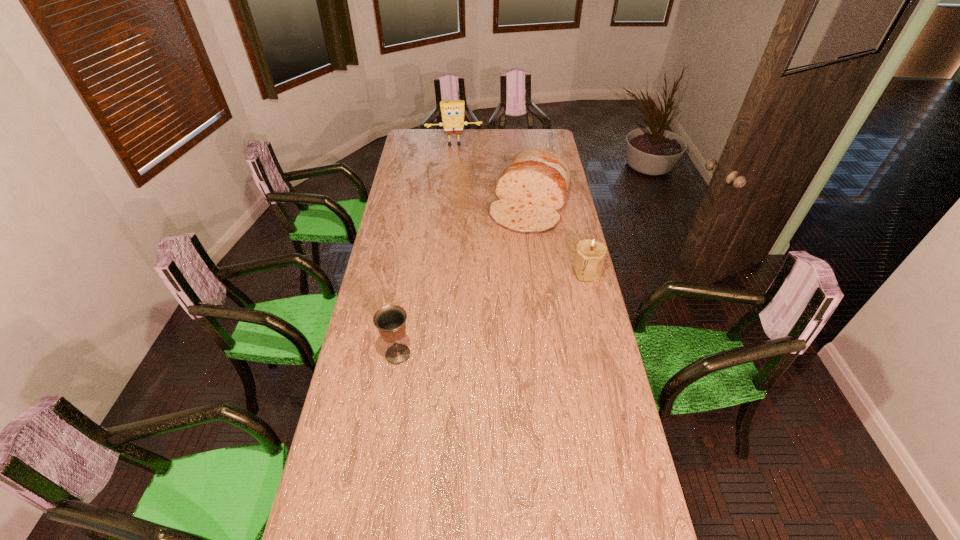
In order to click on vacant spot on the desktop that is between the chalice and the candle_holder and is positioned on the face of the farthest object in this screenshot , I will do `click(472, 322)`.

The height and width of the screenshot is (540, 960). In order to click on free space on the desktop that is between the chalice and the third farthest object and is positioned at the sliced end of the second farthest object in this screenshot , I will do point(484,317).